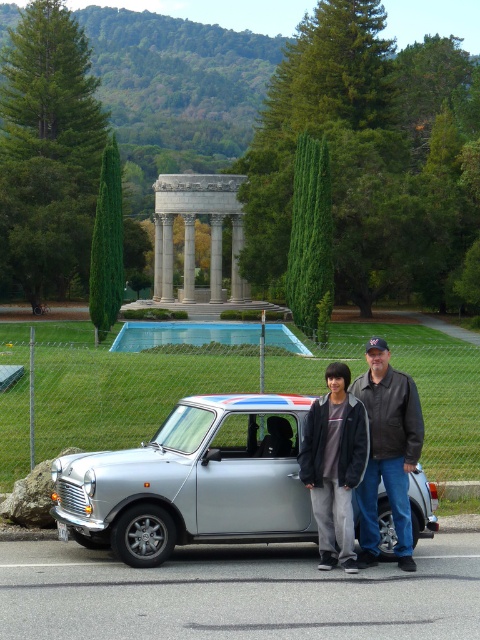
Is point (262, 417) closer to viewer compared to point (364, 387)?

No, it is not.

Does silver metallic car at center have a lesser width compared to dark gray jacket at center?

No.

Does point (241, 508) come farther from viewer compared to point (408, 524)?

That is False.

Find the location of `silver metallic car at center`. silver metallic car at center is located at coordinates (192, 481).